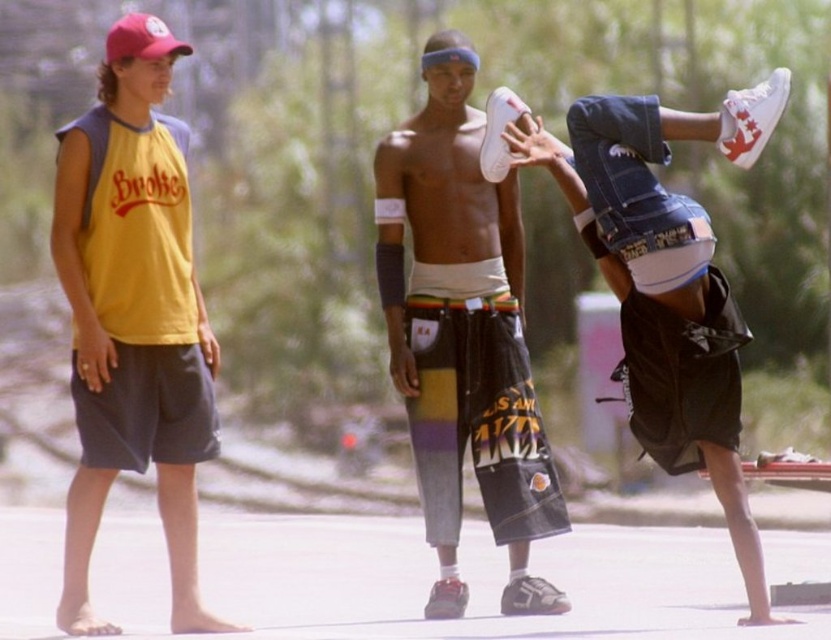
You are a fashion designer observing the skateboarding scene. You notice the white cotton shorts at center and the red fabric baseball cap at upper left. Which clothing item has a narrower width?

The white cotton shorts at center has a narrower width than the red fabric baseball cap at upper left.

You are standing in the park and see two points marked in the image. Which point, point (x=490, y=420) or point (x=621, y=122), is closer to you?

Point (x=490, y=420) is closer to you because it is further to the viewer than point (x=621, y=122).

You are a photographer standing in the park and want to take a photo of the white matte sneakers at center and the red fabric baseball cap at upper left. Which object will appear larger in the photo?

The white matte sneakers at center will appear larger in the photo because it is closer to the viewer than the red fabric baseball cap at upper left.